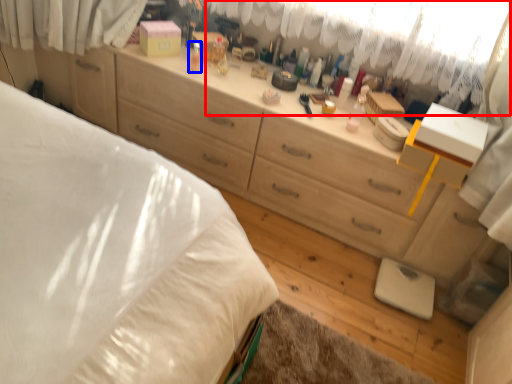
Question: Which point is further to the camera, curtain (highlighted by a red box) or toiletry (highlighted by a blue box)?

Choices:
 (A) curtain
 (B) toiletry

Answer: (B)